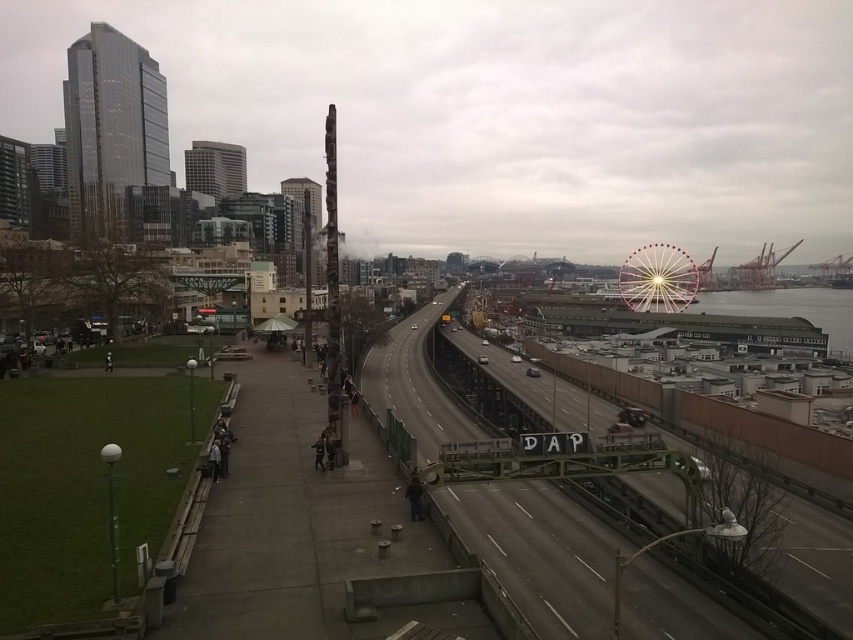
You are standing at the pedestrian walkway and want to cross to the other side. The metallic gray train track at center is in your path. Is there a safe crossing point near the track?

The metallic gray train track at center is located at point (538, 554), so you should look for a designated crossing area near that coordinate to safely cross the tracks.

You are an urban planner assessing the city layout. You need to determine which structure occupies more space in the scene between the metallic gray train track at center and the pink metallic ferris wheel at upper right. Which one is larger?

The metallic gray train track at center is larger in size than the pink metallic ferris wheel at upper right, so the train track occupies more space in the scene.